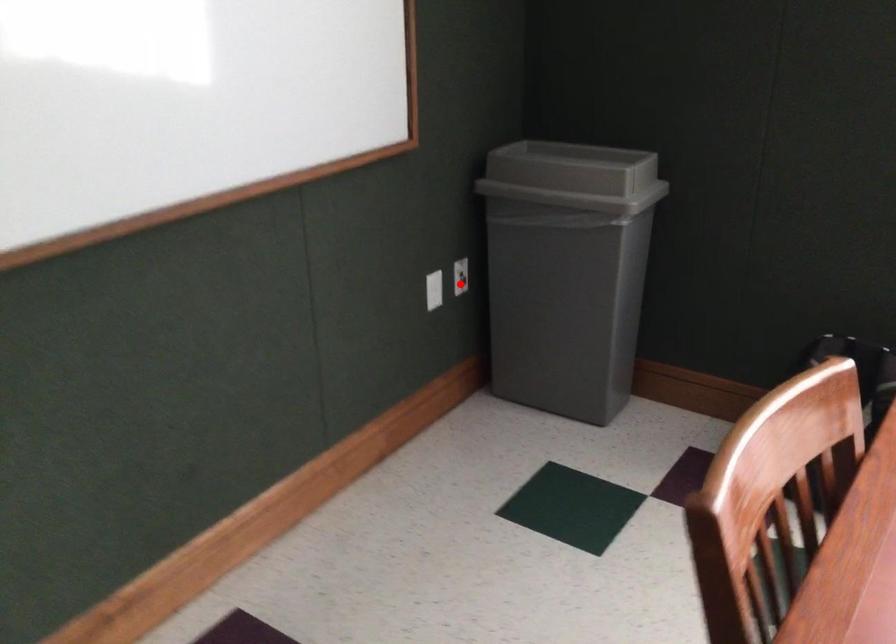
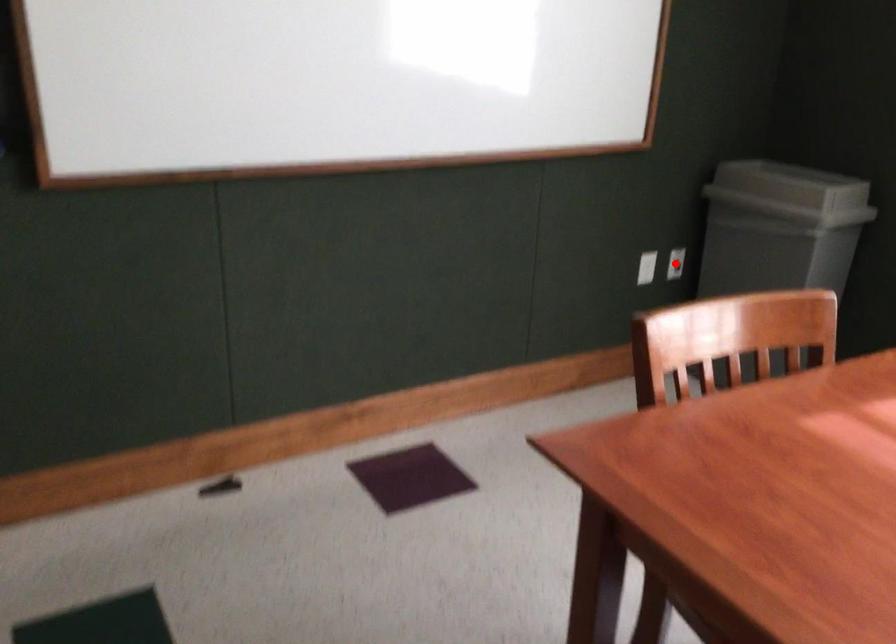
I am providing you with two images of the same scene from different viewpoints. A red point is marked on the first image and another point is marked on the second image. Is the red point in image1 aligned with the point shown in image2?

Yes